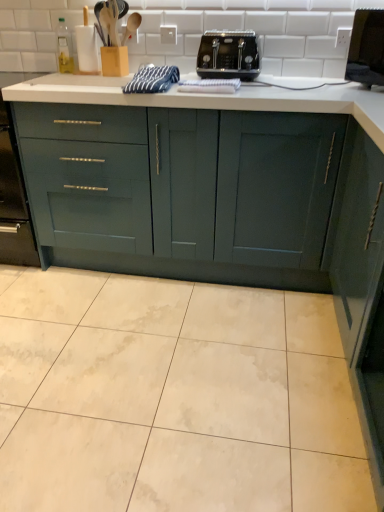
What do you see at coordinates (168, 34) in the screenshot? Image resolution: width=384 pixels, height=512 pixels. I see `white plastic electric outlet at upper center` at bounding box center [168, 34].

I want to click on blue striped towel at center, so click(153, 79).

Is black plastic microwave at upper right oriented away from black plastic toaster at center?

black plastic microwave at upper right is not turned away from black plastic toaster at center.

How different are the orientations of black plastic microwave at upper right and black plastic toaster at center in degrees?

black plastic microwave at upper right and black plastic toaster at center are facing 46.7 degrees away from each other.

From the image's perspective, is black plastic microwave at upper right positioned above or below black plastic toaster at center?

From the image's perspective, black plastic microwave at upper right appears below black plastic toaster at center.

Is black plastic microwave at upper right in contact with black plastic toaster at center?

There is a gap between black plastic microwave at upper right and black plastic toaster at center.

From a real-world perspective, is blue striped towel at center located higher than black plastic toaster at center?

No.

Is point (158, 89) in front of point (252, 62)?

Yes, it is.

Which is behind, blue striped towel at center or black plastic toaster at center?

black plastic toaster at center is further from the camera.

From a real-world perspective, is black plastic microwave at upper right below white plastic electric outlet at upper center?

Yes.

In the scene shown: Is black plastic microwave at upper right surrounding white plastic electric outlet at upper center?

Actually, white plastic electric outlet at upper center is outside black plastic microwave at upper right.

Does point (369, 38) appear closer or farther from the camera than point (170, 26)?

Clearly, point (369, 38) is closer to the camera than point (170, 26).

Could you tell me if black plastic microwave at upper right is turned towards white plastic electric outlet at upper center?

No, black plastic microwave at upper right is not turned towards white plastic electric outlet at upper center.

Is white plastic electric outlet at upper center to the right of matte dark green cabinet at right, which ranks as the 1th cabinetry in right-to-left order, from the viewer's perspective?

No.

Which of these two, white plastic electric outlet at upper center or matte dark green cabinet at right, which ranks as the 1th cabinetry in right-to-left order, is smaller?

white plastic electric outlet at upper center is smaller.

Is white plastic electric outlet at upper center in front of matte dark green cabinet at right, which ranks as the 1th cabinetry in right-to-left order?

No, white plastic electric outlet at upper center is further to the viewer.

From the picture: How different are the orientations of teal matte cabinet at center, acting as the first cabinetry starting from the left, and matte dark green cabinet at right, which is counted as the 2th cabinetry, starting from the left, in degrees?

The angle between the facing direction of teal matte cabinet at center, acting as the first cabinetry starting from the left, and the facing direction of matte dark green cabinet at right, which is counted as the 2th cabinetry, starting from the left, is 90.5 degrees.

In terms of height, does teal matte cabinet at center, acting as the first cabinetry starting from the left, look taller or shorter compared to matte dark green cabinet at right, which is counted as the 2th cabinetry, starting from the left?

teal matte cabinet at center, acting as the first cabinetry starting from the left, is shorter than matte dark green cabinet at right, which is counted as the 2th cabinetry, starting from the left.

Can you confirm if teal matte cabinet at center, acting as the first cabinetry starting from the left, is smaller than matte dark green cabinet at right, which ranks as the 1th cabinetry in right-to-left order?

No.

From the image's perspective, is teal matte cabinet at center, which appears as the 2th cabinetry when viewed from the right, located above or below matte dark green cabinet at right, which ranks as the 1th cabinetry in right-to-left order?

Based on their image positions, teal matte cabinet at center, which appears as the 2th cabinetry when viewed from the right, is located above matte dark green cabinet at right, which ranks as the 1th cabinetry in right-to-left order.

Identify the location of toaster behind the blue striped towel at center. (228, 55).

Considering the sizes of objects black plastic toaster at center and blue striped towel at center in the image provided, who is bigger, black plastic toaster at center or blue striped towel at center?

black plastic toaster at center.

Who is more distant, black plastic toaster at center or blue striped towel at center?

black plastic toaster at center is further away from the camera.

Does black plastic toaster at center appear on the right side of blue striped towel at center?

Correct, you'll find black plastic toaster at center to the right of blue striped towel at center.

Does white plastic electric outlet at upper center lie behind blue striped towel at center?

Yes, white plastic electric outlet at upper center is further from the camera.

From the image's perspective, between white plastic electric outlet at upper center and blue striped towel at center, who is located below?

From the image's view, blue striped towel at center is below.

Considering the sizes of objects white plastic electric outlet at upper center and blue striped towel at center in the image provided, who is taller, white plastic electric outlet at upper center or blue striped towel at center?

With more height is blue striped towel at center.

Is white plastic electric outlet at upper center directly adjacent to blue striped towel at center?

No, white plastic electric outlet at upper center is not with blue striped towel at center.

Where is `toaster that appears above the black plastic microwave at upper right (from the image's perspective)`? The width and height of the screenshot is (384, 512). toaster that appears above the black plastic microwave at upper right (from the image's perspective) is located at coordinates (228, 55).

Where is `toaster behind the blue striped towel at center`? The image size is (384, 512). toaster behind the blue striped towel at center is located at coordinates (228, 55).

Which object lies further to the anchor point white plastic electric outlet at upper center, black plastic microwave at upper right or blue striped towel at center?

black plastic microwave at upper right is further to white plastic electric outlet at upper center.

Based on their spatial positions, is black plastic toaster at center or white plastic electric outlet at upper center closer to black plastic microwave at upper right?

The object closer to black plastic microwave at upper right is black plastic toaster at center.

From the image, which object appears to be farther from black plastic toaster at center, matte dark green cabinet at right, which is counted as the 2th cabinetry, starting from the left, or black plastic microwave at upper right?

matte dark green cabinet at right, which is counted as the 2th cabinetry, starting from the left.

Looking at the image, which one is located closer to teal matte cabinet at center, acting as the first cabinetry starting from the left, black plastic toaster at center or white plastic electric outlet at upper center?

black plastic toaster at center is closer to teal matte cabinet at center, acting as the first cabinetry starting from the left.

From the image, which object appears to be nearer to matte dark green cabinet at right, which ranks as the 1th cabinetry in right-to-left order, white plastic electric outlet at upper center or teal matte cabinet at center, which appears as the 2th cabinetry when viewed from the right?

teal matte cabinet at center, which appears as the 2th cabinetry when viewed from the right, lies closer to matte dark green cabinet at right, which ranks as the 1th cabinetry in right-to-left order, than the other object.

Considering their positions, is teal matte cabinet at center, acting as the first cabinetry starting from the left, positioned further to blue striped towel at center than black plastic microwave at upper right?

black plastic microwave at upper right.

From the image, which object appears to be farther from teal matte cabinet at center, acting as the first cabinetry starting from the left, blue striped towel at center or black plastic toaster at center?

Based on the image, black plastic toaster at center appears to be further to teal matte cabinet at center, acting as the first cabinetry starting from the left.

Estimate the real-world distances between objects in this image. Which object is further from matte dark green cabinet at right, which is counted as the 2th cabinetry, starting from the left, white plastic electric outlet at upper center or blue striped towel at center?

white plastic electric outlet at upper center.

You are a GUI agent. You are given a task and a screenshot of the screen. Output one action in this format:
    pyautogui.click(x=<x>, y=<y>)
    Task: Click on the cabinetry between blue striped towel at center and matte dark green cabinet at right, which ranks as the 1th cabinetry in right-to-left order, from left to right
    This screenshot has height=512, width=384.
    Given the screenshot: What is the action you would take?
    pyautogui.click(x=186, y=191)

I want to click on toaster between white plastic electric outlet at upper center and matte dark green cabinet at right, which ranks as the 1th cabinetry in right-to-left order, from top to bottom, so click(x=228, y=55).

Image resolution: width=384 pixels, height=512 pixels. Find the location of `material between black plastic toaster at center and matte dark green cabinet at right, which is counted as the 2th cabinetry, starting from the left, vertically`. material between black plastic toaster at center and matte dark green cabinet at right, which is counted as the 2th cabinetry, starting from the left, vertically is located at coordinates (153, 79).

Find the location of a particular element. The image size is (384, 512). toaster located between blue striped towel at center and black plastic microwave at upper right in the left-right direction is located at coordinates pyautogui.click(x=228, y=55).